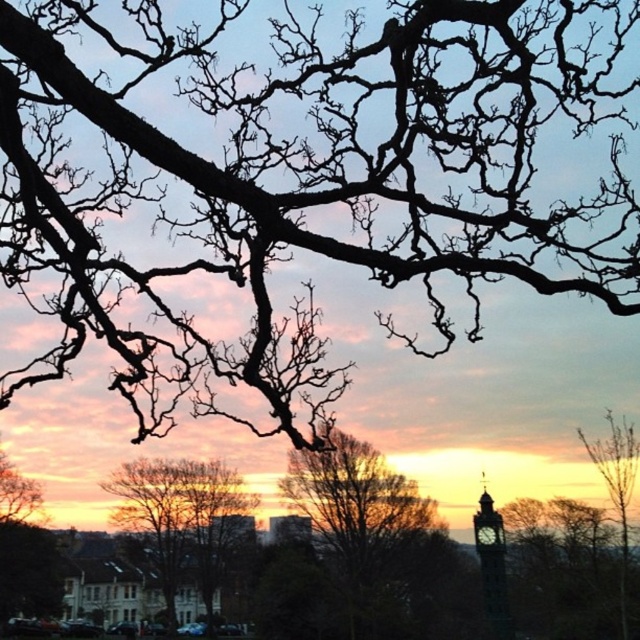
Question: Which point is farther to the camera?

Choices:
 (A) (388, 532)
 (B) (10, 173)
 (C) (486, 547)
 (D) (160, 513)

Answer: (D)

Question: Which point appears closest to the camera in this image?

Choices:
 (A) (492, 538)
 (B) (355, 524)
 (C) (192, 205)
 (D) (481, 508)

Answer: (C)

Question: Is black bare branches at upper center thinner than brown textured tree at center?

Choices:
 (A) no
 (B) yes

Answer: (A)

Question: Which object is positioned closest to the black bare branches at upper center?

Choices:
 (A) smooth brown tree at center
 (B) metallic clock tower at right
 (C) brown textured tree at center

Answer: (C)

Question: Does smooth brown tree at center come behind dark gray stone clock tower at lower right?

Choices:
 (A) no
 (B) yes

Answer: (B)

Question: Considering the relative positions of smooth brown tree at center and metallic clock tower at right in the image provided, where is smooth brown tree at center located with respect to metallic clock tower at right?

Choices:
 (A) right
 (B) left

Answer: (B)